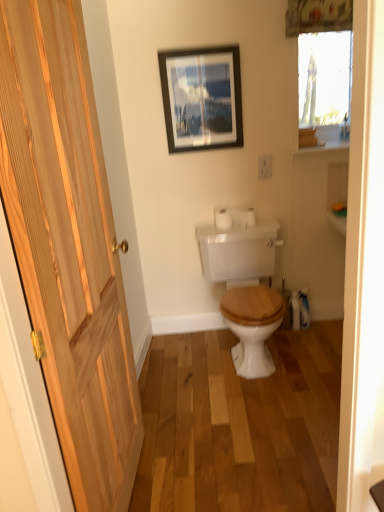
Question: Is point (38, 301) positioned closer to the camera than point (311, 28)?

Choices:
 (A) farther
 (B) closer

Answer: (B)

Question: Considering their positions, is natural wood door at left located in front of or behind floral fabric curtain at upper center?

Choices:
 (A) front
 (B) behind

Answer: (A)

Question: Which object is the farthest from the natural wood door at left?

Choices:
 (A) matte black picture frame at upper center
 (B) white glossy toilet at center
 (C) white matte toilet paper at center
 (D) floral fabric curtain at upper center

Answer: (D)

Question: Which object is positioned farthest from the white glossy toilet at center?

Choices:
 (A) natural wood door at left
 (B) matte black picture frame at upper center
 (C) white matte toilet paper at center
 (D) floral fabric curtain at upper center

Answer: (D)